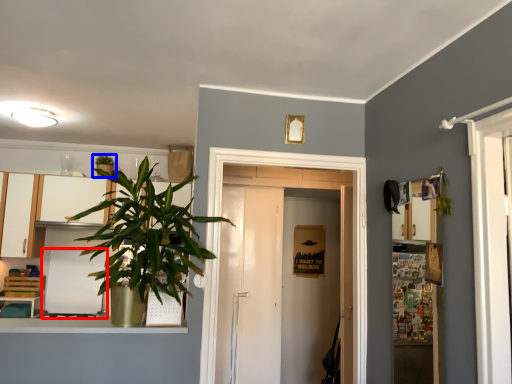
Question: Among these objects, which one is farthest to the camera, appliance (highlighted by a red box) or houseplant (highlighted by a blue box)?

Choices:
 (A) appliance
 (B) houseplant

Answer: (B)